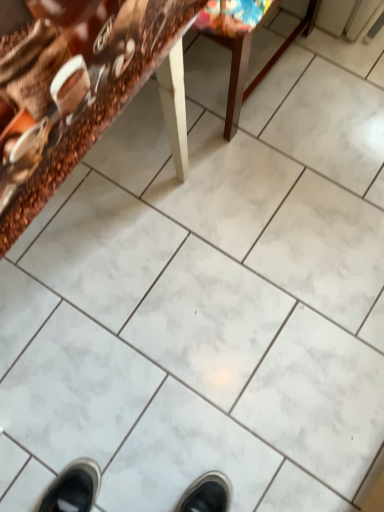
The image size is (384, 512). In order to click on vacant region in front of wooden armchair at upper center in this screenshot , I will do `click(240, 176)`.